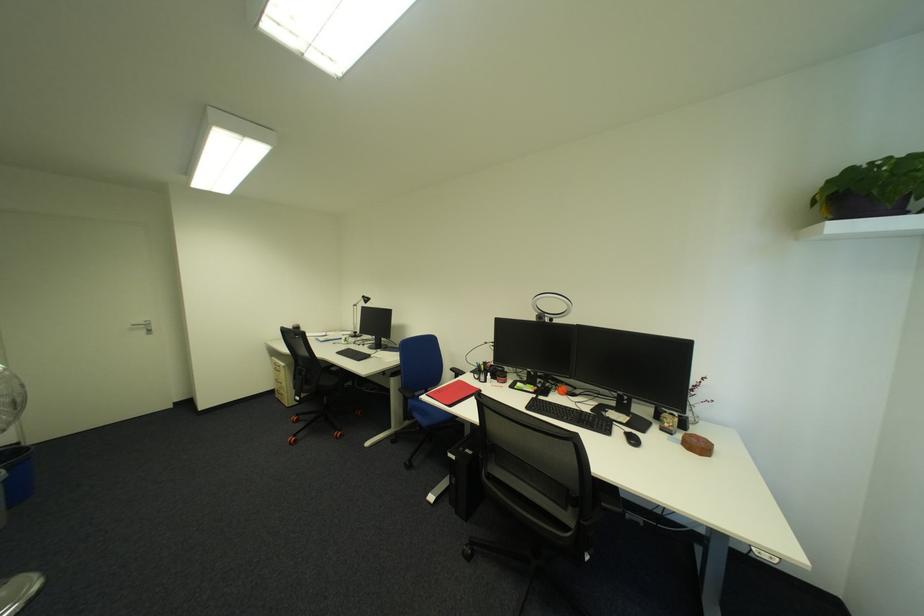
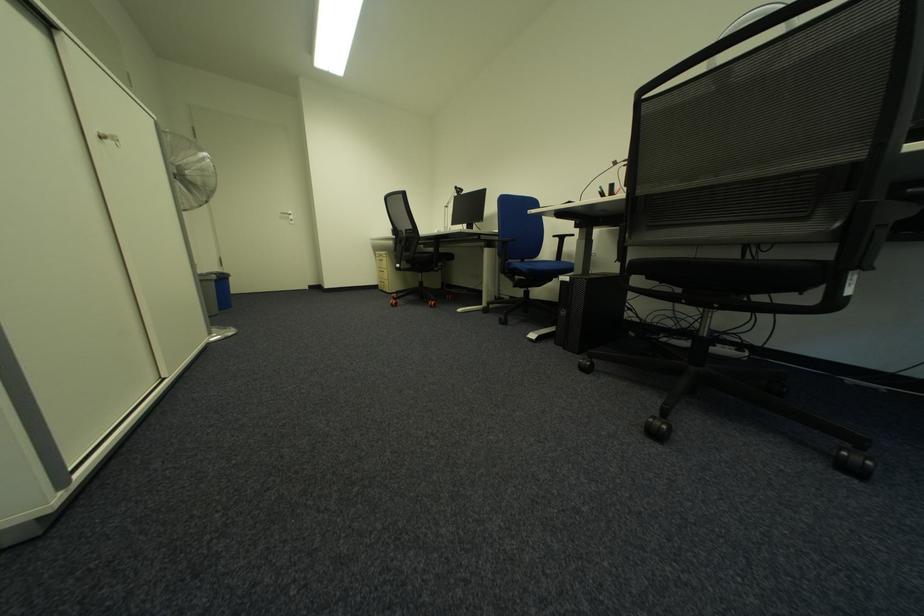
Consider the image. In a continuous first-person perspective shot, in which direction is the camera moving?

The movement direction of the cameraman is left, forward.